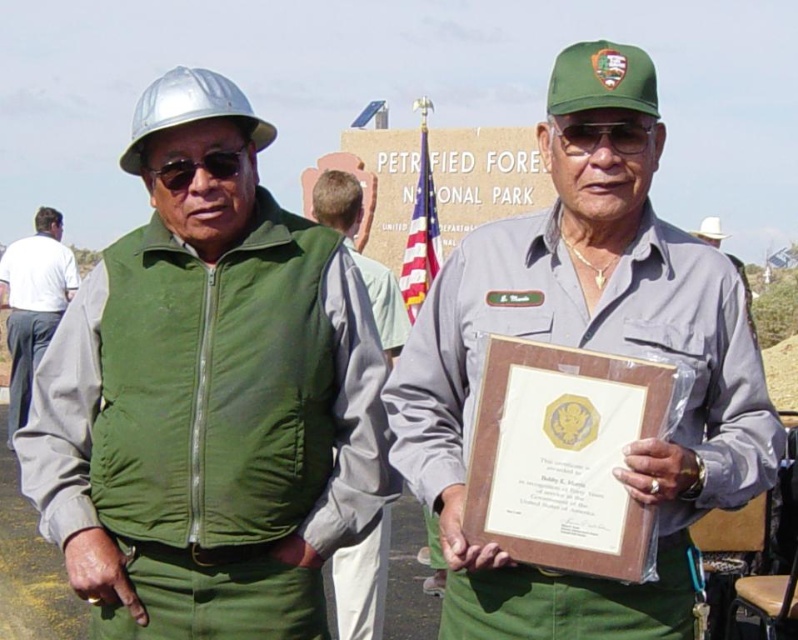
Question: Which of the following is the closest to the observer?

Choices:
 (A) (429, 252)
 (B) (637, 131)
 (C) (109, 381)

Answer: (B)

Question: Can you confirm if green matte vest at center is bigger than sunglasses at center?

Choices:
 (A) yes
 (B) no

Answer: (A)

Question: Which point appears closest to the camera in this image?

Choices:
 (A) (415, 244)
 (B) (224, 163)
 (C) (12, 253)

Answer: (B)

Question: Which object appears closest to the camera in this image?

Choices:
 (A) american flag at center
 (B) white cotton shirt at left
 (C) green matte vest at center
 (D) sunglasses at center

Answer: (C)

Question: Is gray matte uniform at center to the left of sunglasses at center from the viewer's perspective?

Choices:
 (A) yes
 (B) no

Answer: (B)

Question: Does american flag at center appear over sunglasses at center?

Choices:
 (A) yes
 (B) no

Answer: (A)